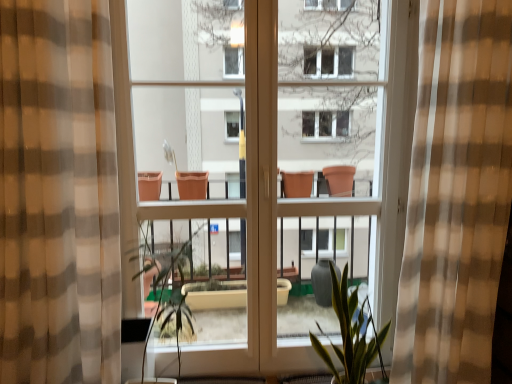
Question: From the image's perspective, relative to brown checkered curtain at left, the 1th curtain when ordered from left to right, is green leafy plant at center above or below?

Choices:
 (A) above
 (B) below

Answer: (B)

Question: In terms of height, does green leafy plant at center look taller or shorter compared to brown checkered curtain at left, the 1th curtain when ordered from left to right?

Choices:
 (A) tall
 (B) short

Answer: (B)

Question: Based on their relative distances, which object is nearer to the checkered fabric curtain at center, which is the 1th curtain in right-to-left order?

Choices:
 (A) brown checkered curtain at left, arranged as the second curtain when viewed from the right
 (B) green matte plant at center
 (C) green leafy plant at center

Answer: (B)

Question: Estimate the real-world distances between objects in this image. Which object is closer to the brown checkered curtain at left, arranged as the second curtain when viewed from the right?

Choices:
 (A) green matte plant at center
 (B) green leafy plant at center
 (C) checkered fabric curtain at center, which is the 1th curtain in right-to-left order

Answer: (B)